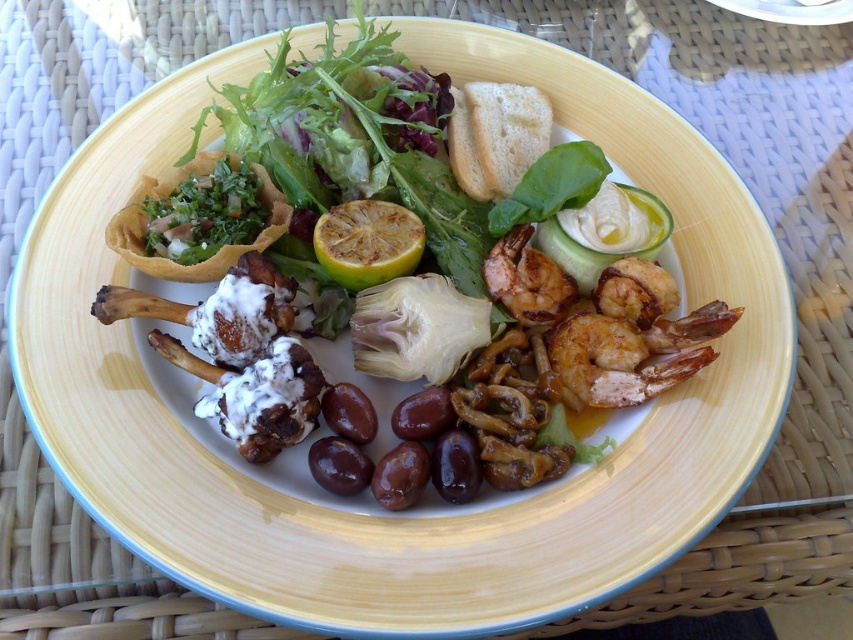
What do you see at coordinates (367, 243) in the screenshot? This screenshot has height=640, width=853. I see `yellow juicy lemon at center` at bounding box center [367, 243].

Which is in front, point (345, 266) or point (509, 296)?

Point (345, 266)

Where is `yellow juicy lemon at center`? yellow juicy lemon at center is located at coordinates (367, 243).